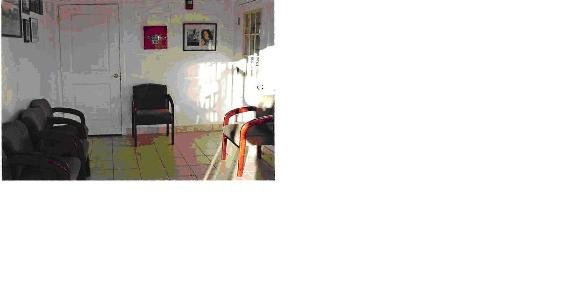
You are a GUI agent. You are given a task and a screenshot of the screen. Output one action in this format:
    pyautogui.click(x=<x>, y=<y>)
    Task: Click on the chair facing the viewer
    
    Given the screenshot: What is the action you would take?
    pyautogui.click(x=147, y=103)